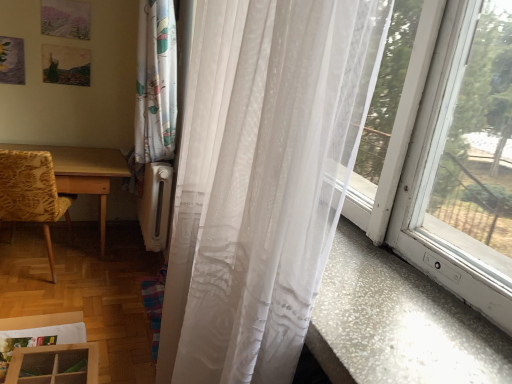
At what (x,y) coordinates should I click in order to perform the action: click on vacant space that is in between wooden table at left and yellow floral fabric chair at left. Please return your answer as a coordinate pair (x, y). This screenshot has height=384, width=512. Looking at the image, I should click on (82, 274).